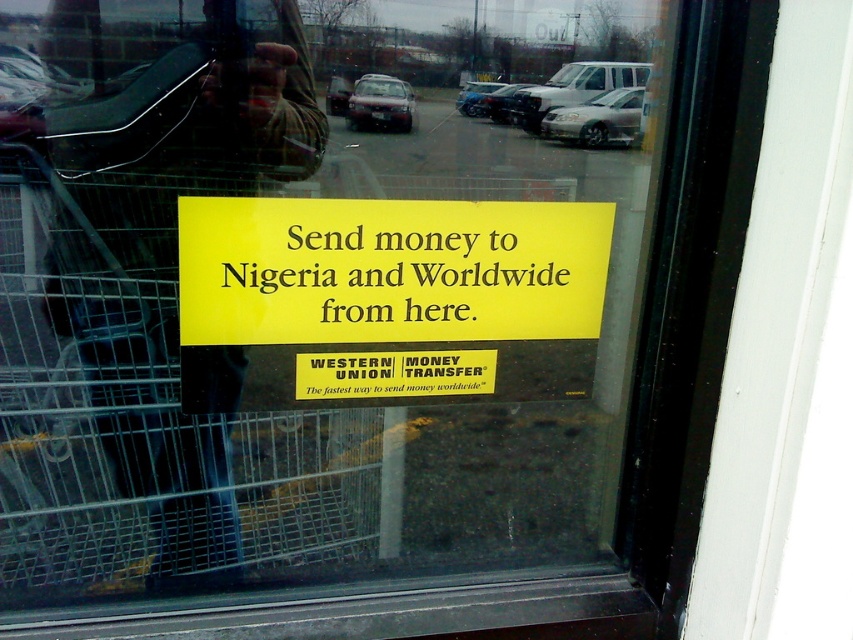
What are the coordinates of the yellow matte sign at center in the image?

The yellow matte sign at center is located at coordinates (387, 300).

Consider the image. You are standing in front of the window with the yellow sign. You notice two points marked on the window. Which point is closer to you, point (480, 230) or point (548, 252)?

Point (480, 230) is in front of point (548, 252), so it is closer to you.